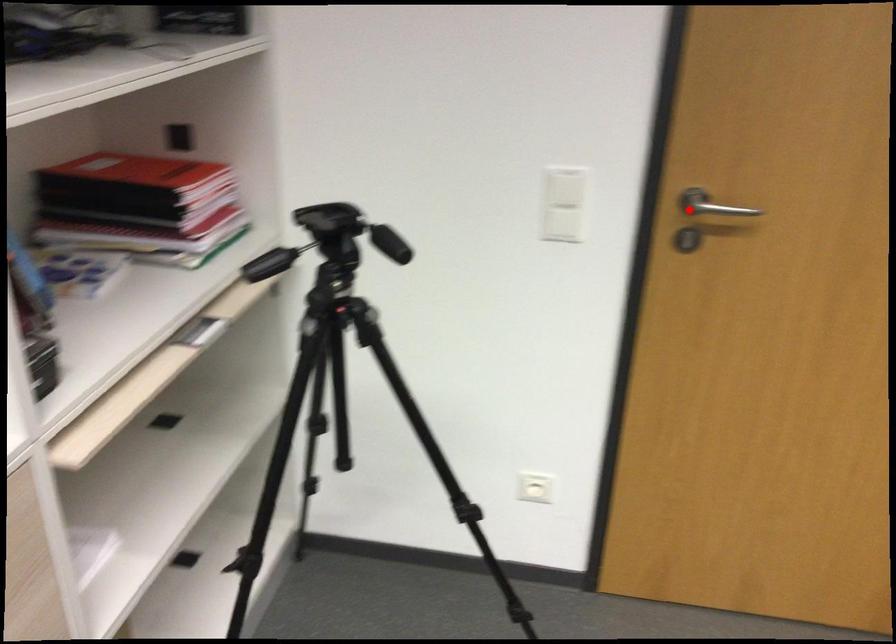
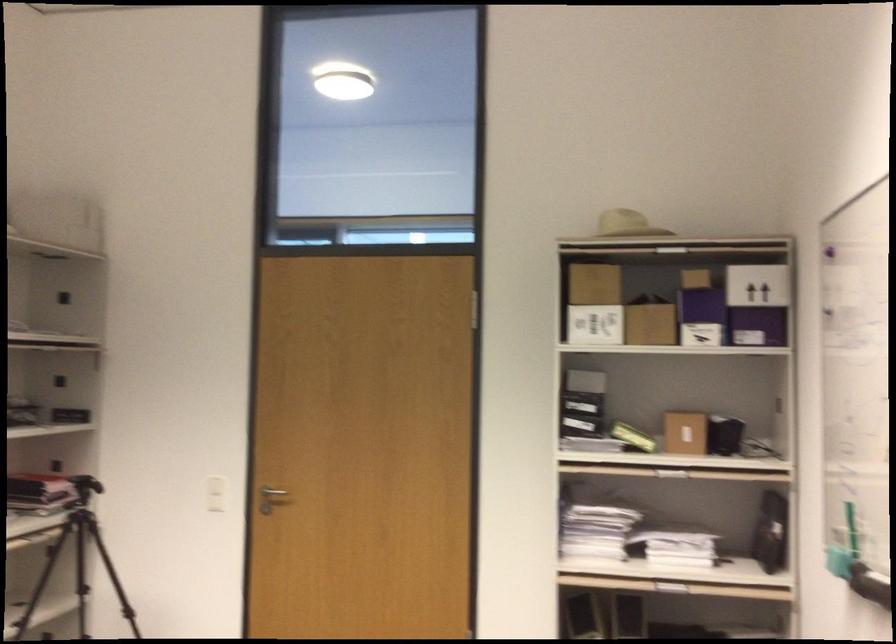
Question: I am providing you with two images of the same scene from different viewpoints. Given a red point in image1, look at the same physical point in image2. Is it:

Choices:
 (A) Closer to the viewpoint
 (B) Farther from the viewpoint

Answer: (B)